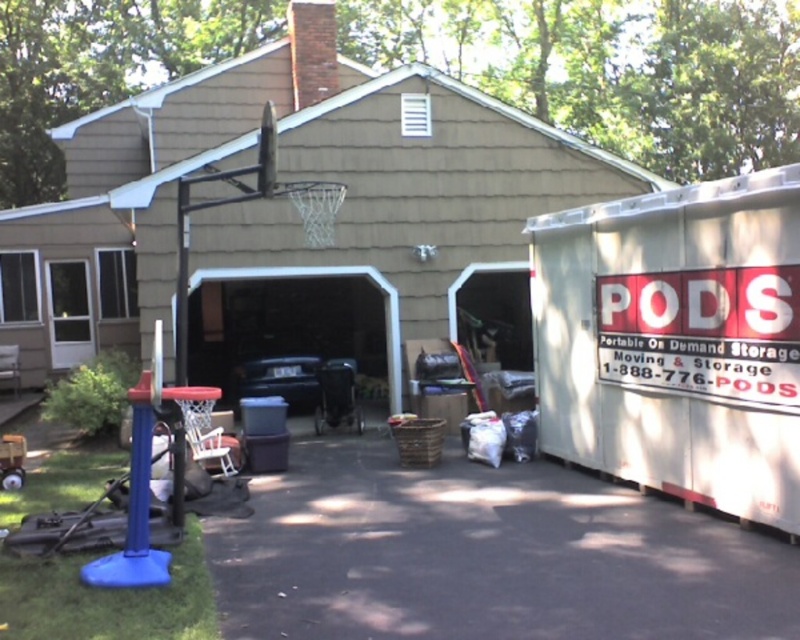
Which is behind, point (389, 301) or point (538, 592)?

Point (389, 301)

Is the position of white plastic storage container at right more distant than that of black asphalt driveway at lower center?

Yes, it is behind black asphalt driveway at lower center.

Find the location of a particular element. This screenshot has height=640, width=800. white plastic storage container at right is located at coordinates (294, 216).

Locate an element on the screen. white plastic storage container at right is located at coordinates (294, 216).

Can you confirm if black asphalt driveway at lower center is positioned to the left of matte black carport at center?

Incorrect, black asphalt driveway at lower center is not on the left side of matte black carport at center.

Which is behind, point (704, 579) or point (398, 308)?

Positioned behind is point (398, 308).

This screenshot has height=640, width=800. What are the coordinates of `black asphalt driveway at lower center` in the screenshot? It's located at [x=484, y=554].

Is point (52, 333) closer to camera compared to point (389, 308)?

No, (52, 333) is behind (389, 308).

Which is more to the left, white plastic storage container at right or matte black carport at center?

matte black carport at center

Where is `white plastic storage container at right`? white plastic storage container at right is located at coordinates (294, 216).